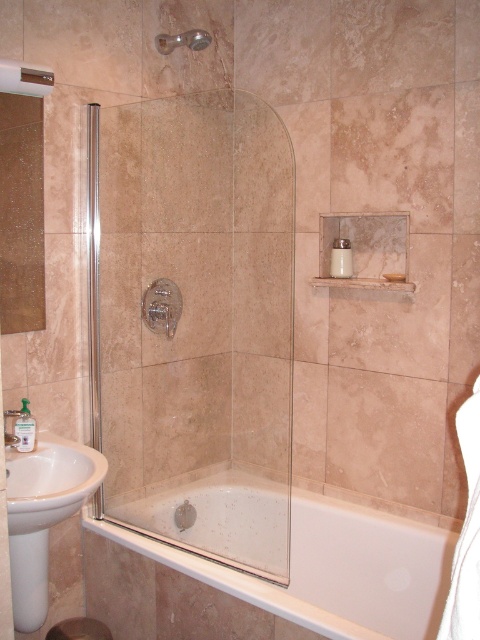
Can you confirm if clear glass shower door at center is smaller than white glossy bathtub at lower center?

No, clear glass shower door at center is not smaller than white glossy bathtub at lower center.

Which is behind, point (115, 323) or point (364, 605)?

Positioned behind is point (115, 323).

Describe the element at coordinates (197, 324) in the screenshot. I see `clear glass shower door at center` at that location.

This screenshot has height=640, width=480. I want to click on clear glass shower door at center, so click(197, 324).

Can you confirm if matte silver showerhead at upper center is smaller than brushed metal faucet at lower left?

No, matte silver showerhead at upper center is not smaller than brushed metal faucet at lower left.

Who is taller, matte silver showerhead at upper center or brushed metal faucet at lower left?

matte silver showerhead at upper center

This screenshot has height=640, width=480. Find the location of `matte silver showerhead at upper center`. matte silver showerhead at upper center is located at coordinates (182, 40).

Does white ceramic sink at lower left have a larger size compared to matte silver showerhead at upper center?

Indeed, white ceramic sink at lower left has a larger size compared to matte silver showerhead at upper center.

Can you confirm if white ceramic sink at lower left is thinner than matte silver showerhead at upper center?

In fact, white ceramic sink at lower left might be wider than matte silver showerhead at upper center.

Which is behind, point (34, 545) or point (179, 44)?

Positioned behind is point (179, 44).

I want to click on white ceramic sink at lower left, so click(x=43, y=513).